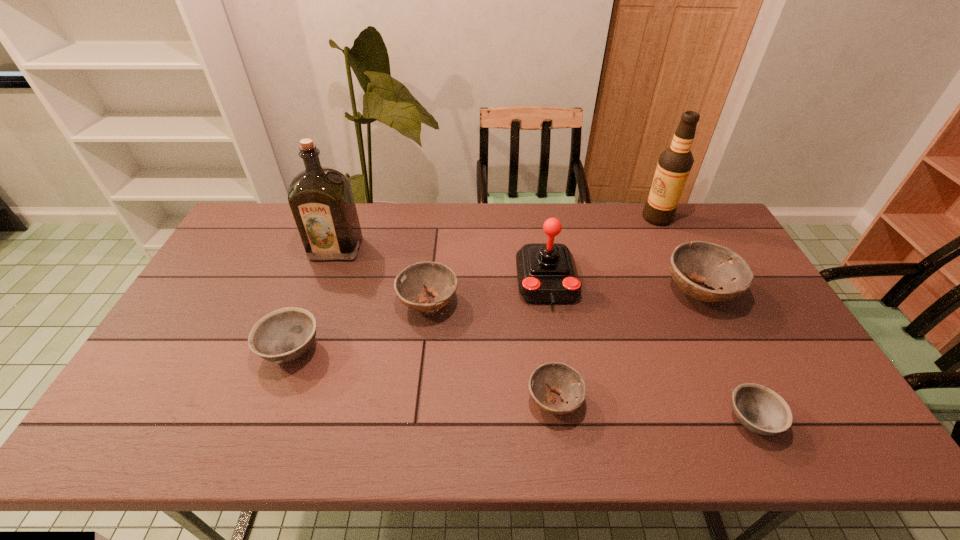
At what (x,y) coordinates should I click in order to perform the action: click on vacant space that satisfies the following two spatial constraints: 1. on the front side of the smaller gray bowl; 2. on the left side of the second biggest brown bowl. Please return your answer as a coordinate pair (x, y). This screenshot has height=540, width=960. Looking at the image, I should click on (415, 420).

Identify the location of free location that satisfies the following two spatial constraints: 1. on the label of the right gray bowl; 2. on the left side of the liquor. (275, 420).

Where is `free point that satisfies the following two spatial constraints: 1. on the label of the farthest object; 2. on the label of the liquor`? The height and width of the screenshot is (540, 960). free point that satisfies the following two spatial constraints: 1. on the label of the farthest object; 2. on the label of the liquor is located at coordinates (672, 249).